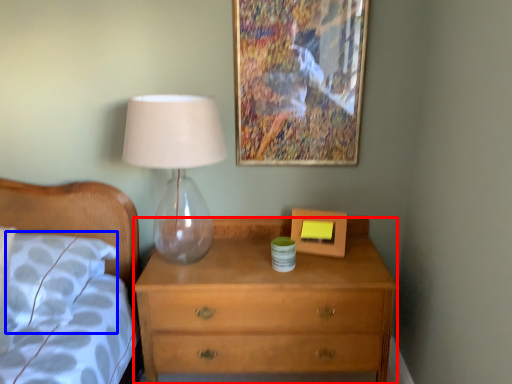
Question: Which of the following is the farthest to the observer, chest of drawers (highlighted by a red box) or pillow (highlighted by a blue box)?

Choices:
 (A) chest of drawers
 (B) pillow

Answer: (A)